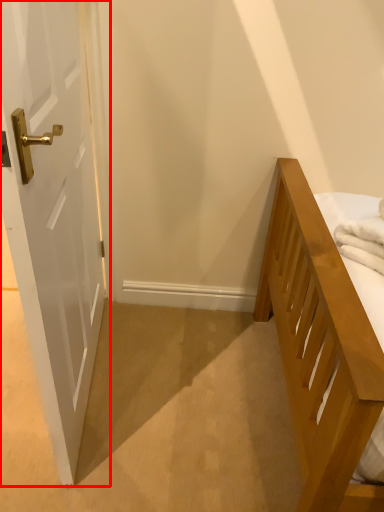
Question: From the image's perspective, what is the correct spatial relationship of door (annotated by the red box) in relation to bath towel?

Choices:
 (A) above
 (B) below

Answer: (A)